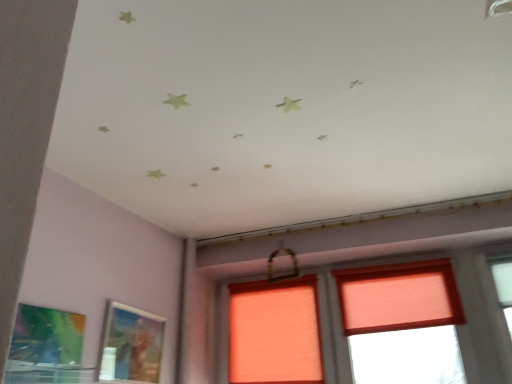
Question: Relative to metallic silver picture frame at lower left, which ranks as the 2th picture frame in front-to-back order, is orange fabric window at center in front or behind?

Choices:
 (A) front
 (B) behind

Answer: (B)

Question: Is orange fabric window at center to the left or to the right of metallic silver picture frame at lower left, which ranks as the 2th picture frame in front-to-back order, in the image?

Choices:
 (A) right
 (B) left

Answer: (A)

Question: Which is nearer to the orange fabric window at center?

Choices:
 (A) metallic silver picture frame at lower left, which ranks as the 2th picture frame in front-to-back order
 (B) matte green painting at lower left, the first picture frame positioned from the left

Answer: (A)

Question: Estimate the real-world distances between objects in this image. Which object is farther from the metallic silver picture frame at lower left, which ranks as the 2th picture frame in front-to-back order?

Choices:
 (A) orange fabric window at center
 (B) matte green painting at lower left, the first picture frame in the front-to-back sequence

Answer: (A)